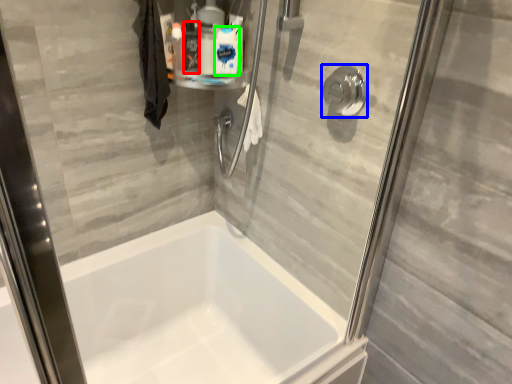
Question: Which object is positioned farthest from cleaning product (highlighted by a red box)? Select from shower (highlighted by a blue box) and cleaning product (highlighted by a green box).

Choices:
 (A) shower
 (B) cleaning product

Answer: (A)